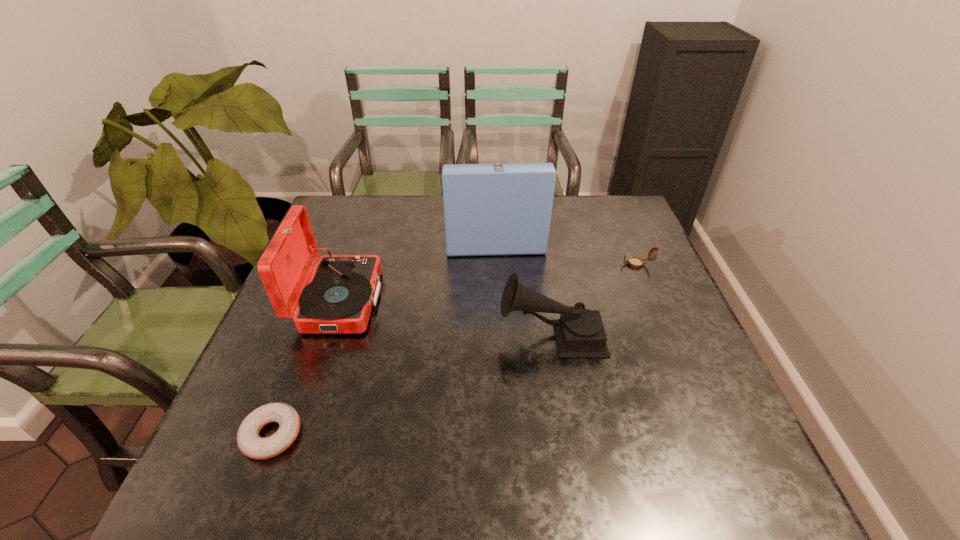
You are a GUI agent. You are given a task and a screenshot of the screen. Output one action in this format:
    pyautogui.click(x=<x>, y=<y>)
    Task: Click on the vacant space at the near right corner of the desktop
    The width and height of the screenshot is (960, 540).
    Given the screenshot: What is the action you would take?
    pyautogui.click(x=769, y=496)

You are a GUI agent. You are given a task and a screenshot of the screen. Output one action in this format:
    pyautogui.click(x=<x>, y=<y>)
    Task: Click on the vacant space in between the third tallest object and the fourth shortest object
    The image size is (960, 540).
    Given the screenshot: What is the action you would take?
    pyautogui.click(x=445, y=318)

Where is `free space between the shortest phonograph_record and the farthest object`? Image resolution: width=960 pixels, height=540 pixels. free space between the shortest phonograph_record and the farthest object is located at coordinates (523, 280).

Where is `free space between the nearest object and the farthest phonograph_record`? This screenshot has width=960, height=540. free space between the nearest object and the farthest phonograph_record is located at coordinates (383, 330).

Identify the location of free space between the nearest object and the farthest phonograph_record. Image resolution: width=960 pixels, height=540 pixels. pyautogui.click(x=383, y=330).

This screenshot has width=960, height=540. I want to click on free point between the rightmost object and the shortest phonograph_record, so click(595, 299).

Image resolution: width=960 pixels, height=540 pixels. What are the coordinates of `vacant area between the leftmost phonograph_record and the shortest object` in the screenshot? It's located at (306, 368).

At what (x,y) coordinates should I click in order to perform the action: click on vacant area that lies between the farthest object and the leftmost phonograph_record. Please return your answer as a coordinate pair (x, y). The image size is (960, 540). Looking at the image, I should click on (417, 263).

Locate an element on the screen. The width and height of the screenshot is (960, 540). empty space between the rightmost object and the farthest object is located at coordinates (566, 245).

This screenshot has height=540, width=960. In order to click on free space between the farthest phonograph_record and the second tallest object in this screenshot , I will do `click(417, 263)`.